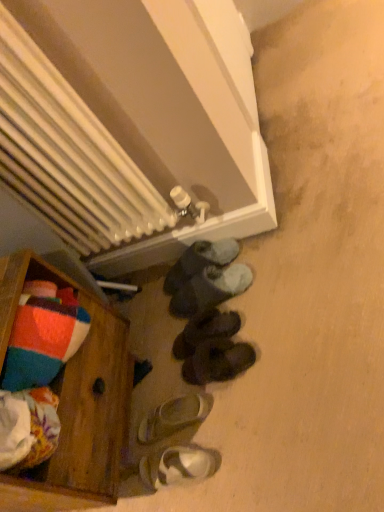
Identify the location of vacant area that lies in front of white matte sandal at lower center, which is the fifth footwear from top to bottom. The image size is (384, 512). (213, 455).